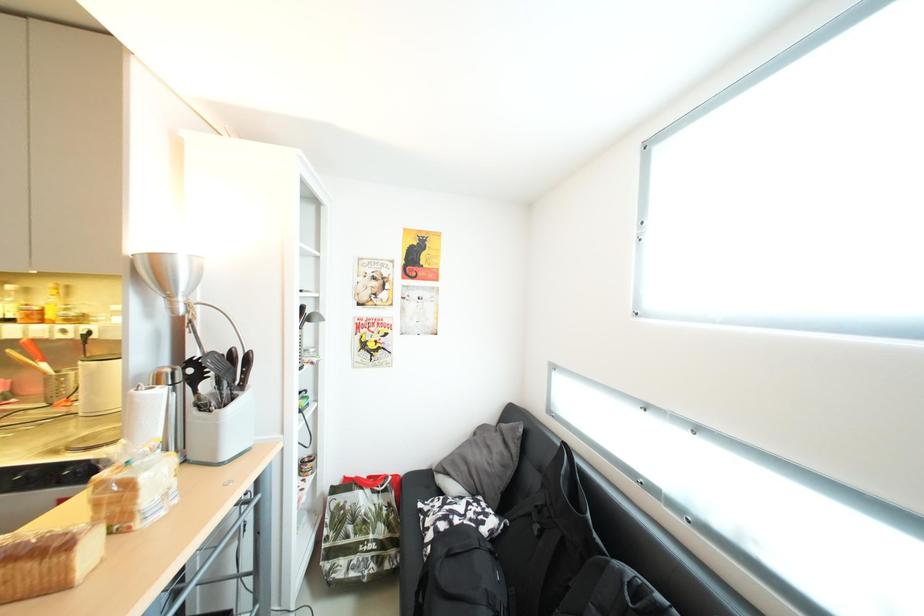
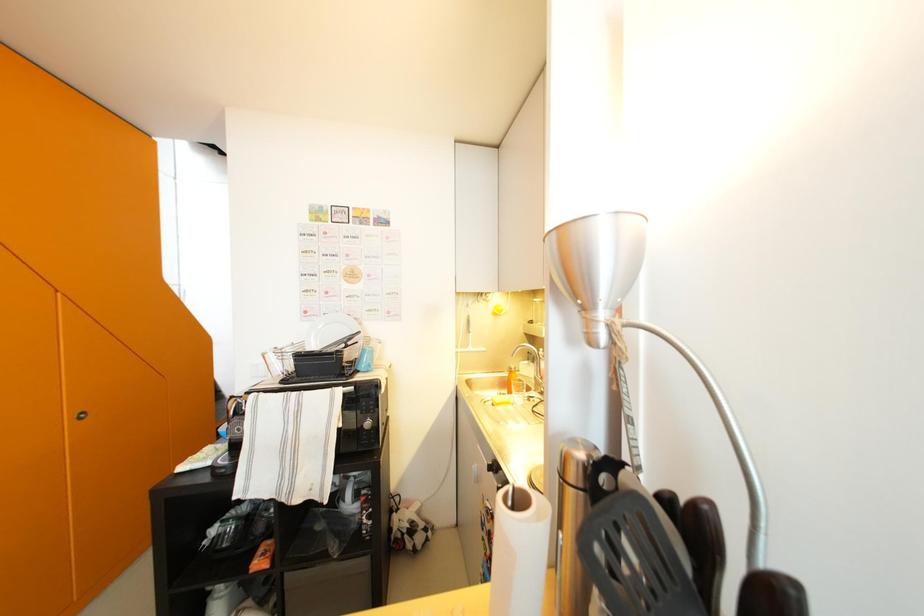
Question: The camera is either moving clockwise (left) or counter-clockwise (right) around the object. The first image is from the beginning of the video and the second image is from the end. Is the camera moving left or right when shooting the video?

Choices:
 (A) Left
 (B) Right

Answer: (B)